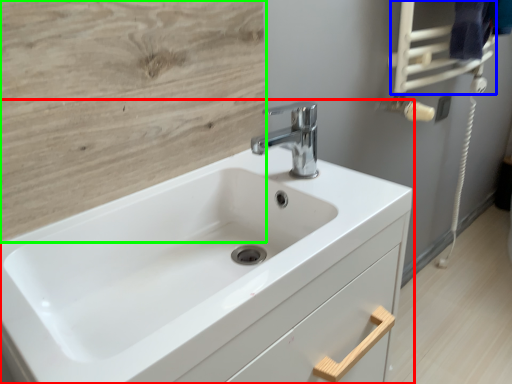
Question: Considering the real-world distances, which object is farthest from sink (highlighted by a red box)? towel bar (highlighted by a blue box) or plywood (highlighted by a green box)?

Choices:
 (A) towel bar
 (B) plywood

Answer: (A)